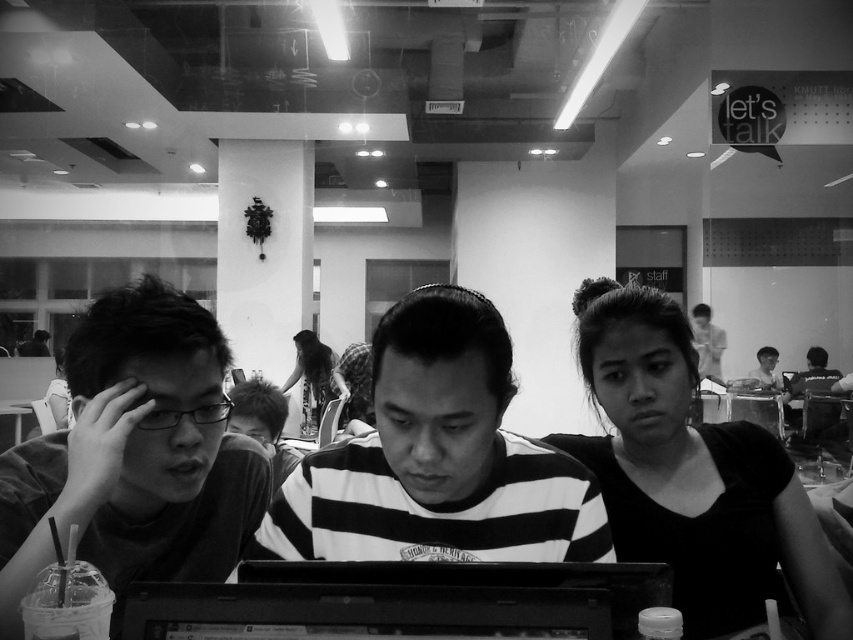
Which is behind, point (351, 554) or point (320, 371)?

Point (320, 371)

Who is higher up, striped fabric shirt at center or floral fabric dress at center?

striped fabric shirt at center is higher up.

Is point (407, 474) farther from viewer compared to point (320, 346)?

That is False.

I want to click on striped fabric shirt at center, so click(x=437, y=458).

Looking at this image, is striped fabric shirt at center bigger than black matte hair at upper right?

Incorrect, striped fabric shirt at center is not larger than black matte hair at upper right.

Can you confirm if striped fabric shirt at center is positioned to the right of black matte hair at upper right?

In fact, striped fabric shirt at center is to the left of black matte hair at upper right.

Locate an element on the screen. striped fabric shirt at center is located at coordinates (437, 458).

At what (x,y) coordinates should I click in order to perform the action: click on striped fabric shirt at center. Please return your answer as a coordinate pair (x, y). Image resolution: width=853 pixels, height=640 pixels. Looking at the image, I should click on 437,458.

Is point (791, 420) closer to camera compared to point (701, 332)?

Yes, it is.

Image resolution: width=853 pixels, height=640 pixels. Describe the element at coordinates (807, 384) in the screenshot. I see `dark gray shirt at right` at that location.

The width and height of the screenshot is (853, 640). I want to click on dark gray shirt at right, so click(807, 384).